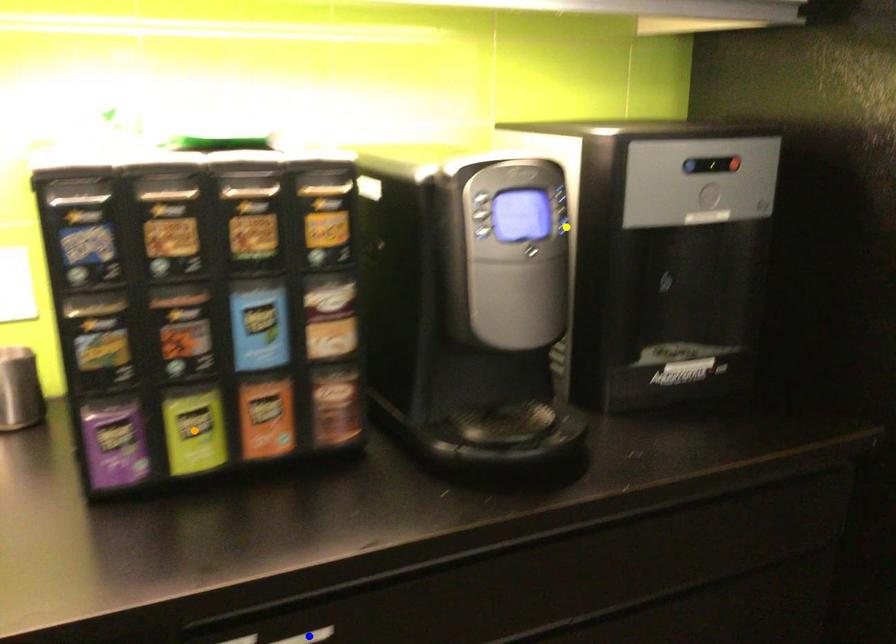
Order these from nearest to farthest:
- yellow point
- orange point
- blue point

blue point, orange point, yellow point